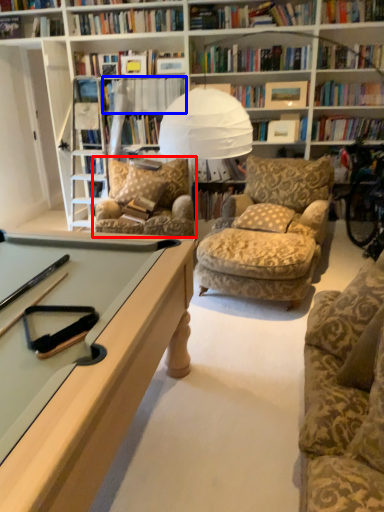
Question: Which point is closer to the camera, chair (highlighted by a red box) or book (highlighted by a blue box)?

Choices:
 (A) chair
 (B) book

Answer: (A)